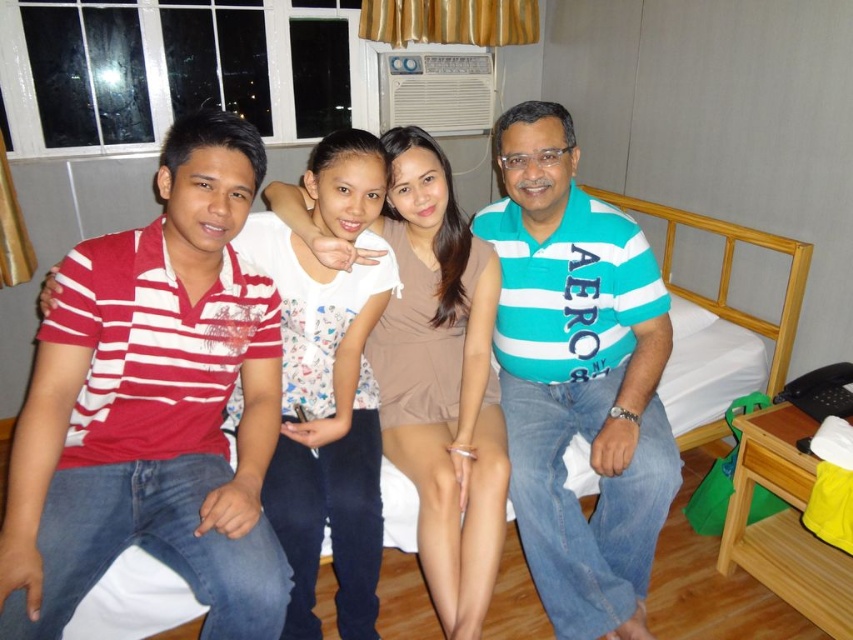
Who is positioned more to the right, teal striped polo shirt at center or white fabric bed at center?

white fabric bed at center

Is point (518, 499) positioned in front of point (723, 221)?

Yes, point (518, 499) is in front of point (723, 221).

Find the location of a particular element. The width and height of the screenshot is (853, 640). teal striped polo shirt at center is located at coordinates (578, 378).